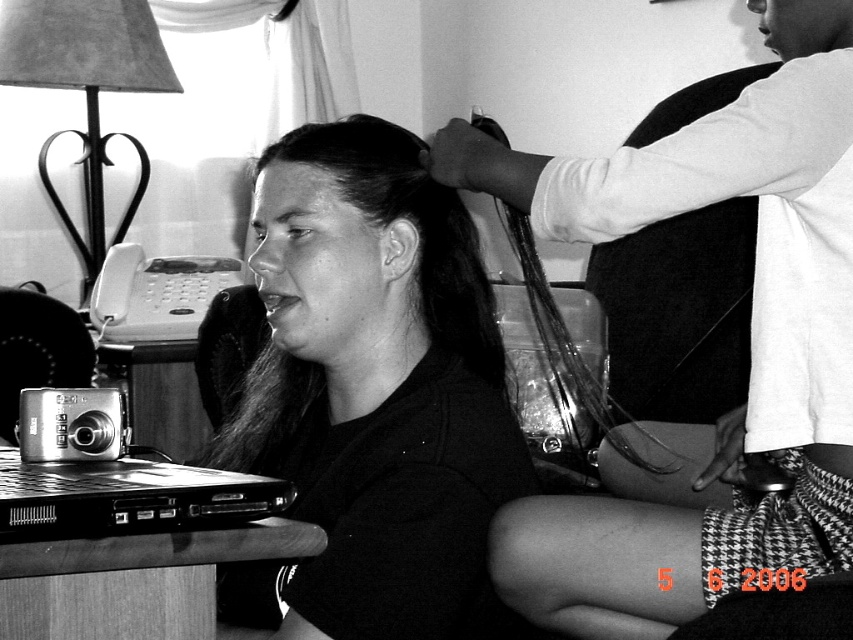
Is smooth white arm at upper right bigger than black plastic laptop at lower left?

Yes.

At what (x,y) coordinates should I click in order to perform the action: click on smooth white arm at upper right. Please return your answer as a coordinate pair (x, y). The width and height of the screenshot is (853, 640). Looking at the image, I should click on [751, 340].

Can you confirm if smooth dark hair at center is thinner than smooth white arm at upper right?

No.

This screenshot has height=640, width=853. Find the location of `smooth dark hair at center`. smooth dark hair at center is located at coordinates (374, 394).

Who is positioned more to the left, smooth dark hair at center or black plastic laptop at lower left?

From the viewer's perspective, black plastic laptop at lower left appears more on the left side.

In order to click on smooth dark hair at center in this screenshot , I will do `click(374, 394)`.

This screenshot has width=853, height=640. In order to click on smooth dark hair at center in this screenshot , I will do `click(374, 394)`.